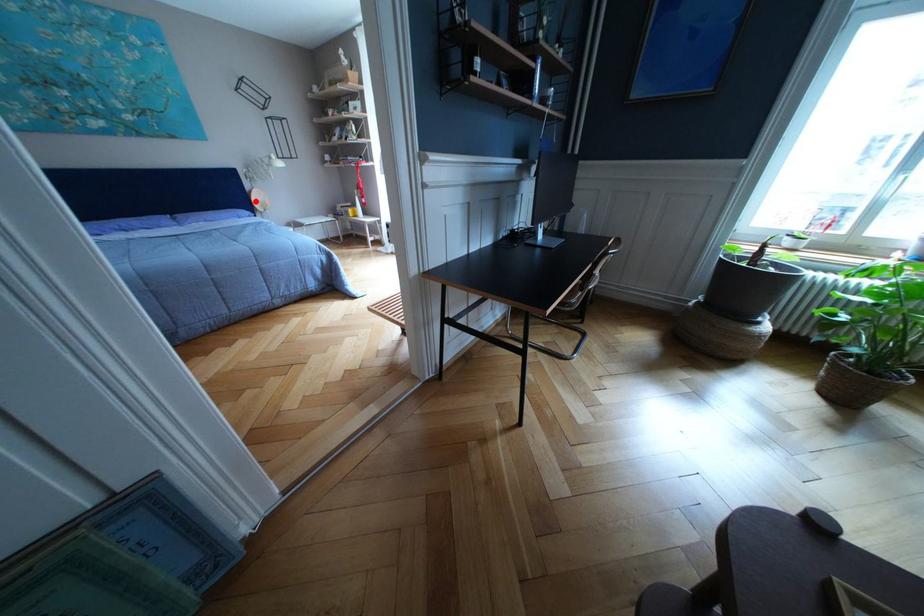
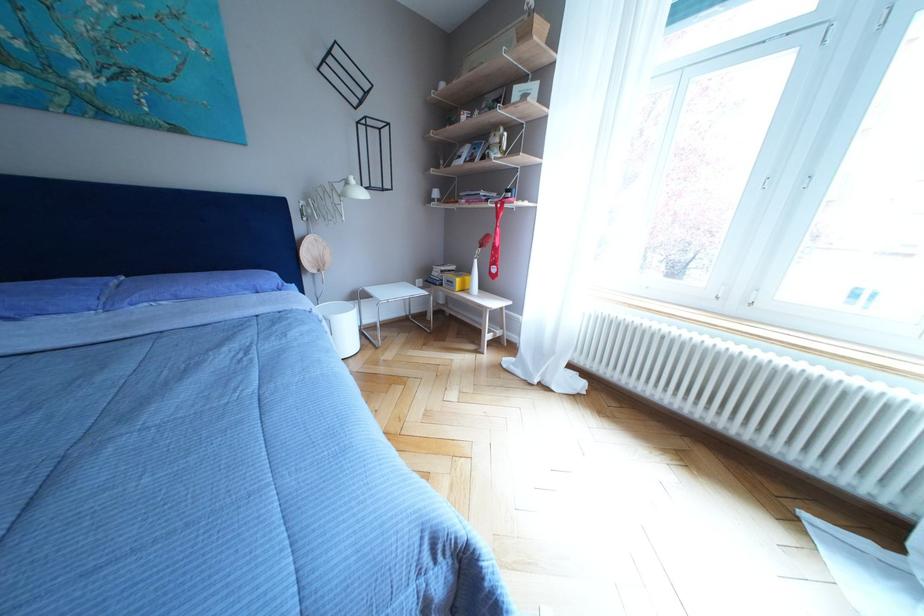
The point at the highlighted location is marked in the first image. Where is the corresponding point in the second image?

(302, 251)